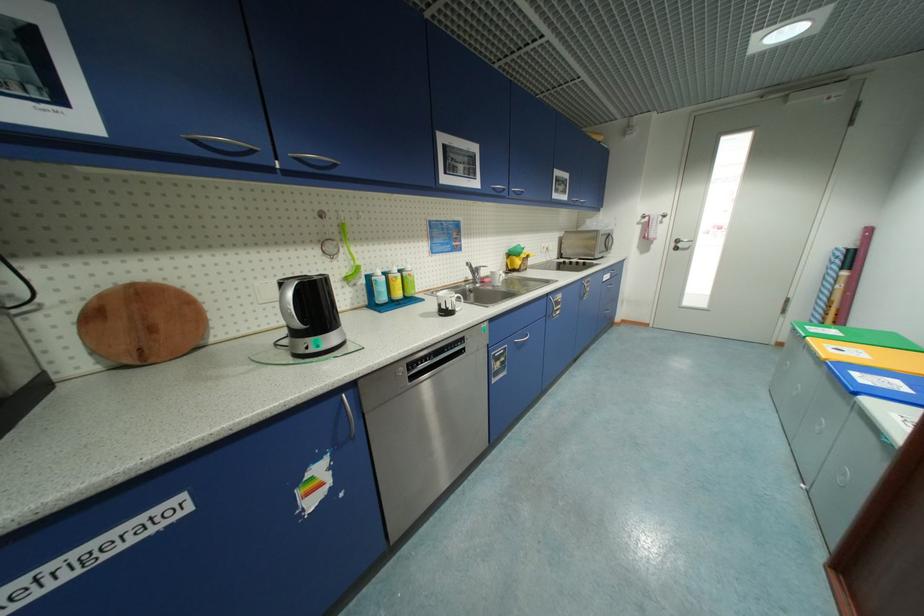
Image resolution: width=924 pixels, height=616 pixels. Identify the location of blue bin lid. (882, 381).